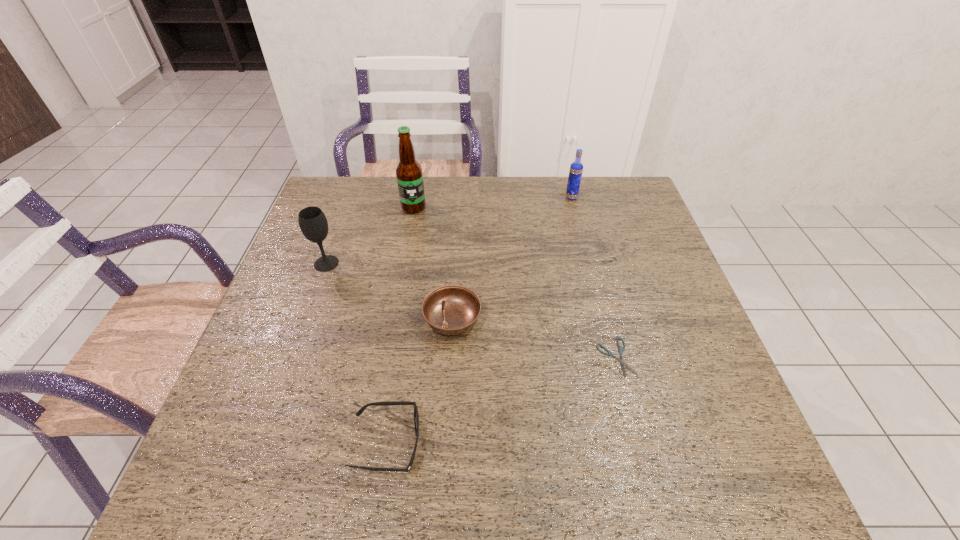
Where is `the tallest object`? The height and width of the screenshot is (540, 960). the tallest object is located at coordinates (409, 175).

Image resolution: width=960 pixels, height=540 pixels. I want to click on the leftmost object, so click(x=312, y=221).

Find the location of `the fourth nearest object`. the fourth nearest object is located at coordinates (312, 221).

The image size is (960, 540). Find the location of `vodka`. vodka is located at coordinates (576, 168).

Find the location of a particular element. soup bowl is located at coordinates (450, 310).

You are a GUI agent. You are given a task and a screenshot of the screen. Output one action in this format:
    pyautogui.click(x=<x>, y=<y>)
    Task: Click on the nearest object
    The image size is (960, 540).
    Given the screenshot: What is the action you would take?
    pyautogui.click(x=416, y=417)

The image size is (960, 540). I want to click on the shortest object, so pos(609,353).

You are a GUI agent. You are given a task and a screenshot of the screen. Output one action in this format:
    pyautogui.click(x=<x>, y=<y>)
    Task: Click on the vacant space located on the label of the beer bottle
    The height and width of the screenshot is (540, 960).
    Given the screenshot: What is the action you would take?
    pyautogui.click(x=406, y=252)

Identify the location of free space located on the back of the fourth nearest object. This screenshot has width=960, height=540. (340, 226).

This screenshot has width=960, height=540. I want to click on free region located 0.090m on the right of the vodka, so click(606, 197).